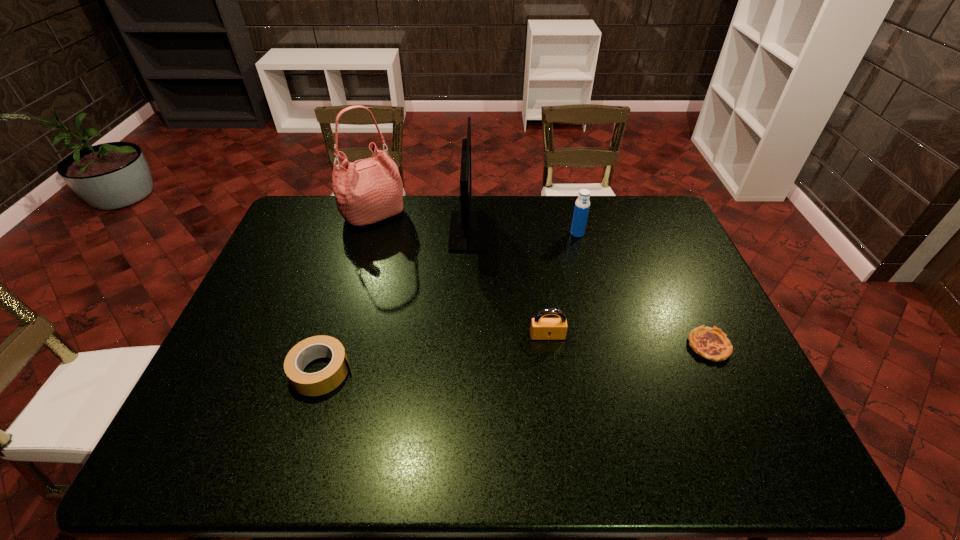
This screenshot has width=960, height=540. Find the location of `unoccupied area between the monitor and the duct tape`. unoccupied area between the monitor and the duct tape is located at coordinates (396, 301).

Find the location of a particular element. empty space that is in between the fourth object from left to right and the second object from right to left is located at coordinates (563, 285).

Identify the location of object that is the fourth closest to the fifth object from left to right. (369, 190).

This screenshot has height=540, width=960. Identify the location of object that ranks as the second closest to the shortest object. click(582, 204).

At what (x,y) coordinates should I click in order to perform the action: click on free location that satisfies the following two spatial constraints: 1. to unlock the rightmost object from the front; 2. on the right side of the third object from right to left. Please return your answer as a coordinate pair (x, y). Looking at the image, I should click on (549, 346).

This screenshot has height=540, width=960. Identify the location of vacant space that satisfies the following two spatial constraints: 1. on the front side of the fourth shortest object; 2. at the edge of the second shortest object. (612, 372).

The width and height of the screenshot is (960, 540). In order to click on free spot that satisfies the following two spatial constraints: 1. on the screen side of the rightmost object; 2. on the left side of the third object from left to right in this screenshot , I will do `click(465, 346)`.

Find the location of a particular element. The height and width of the screenshot is (540, 960). vacant point that satisfies the following two spatial constraints: 1. on the screen side of the third object from left to right; 2. on the left side of the shortest object is located at coordinates (465, 346).